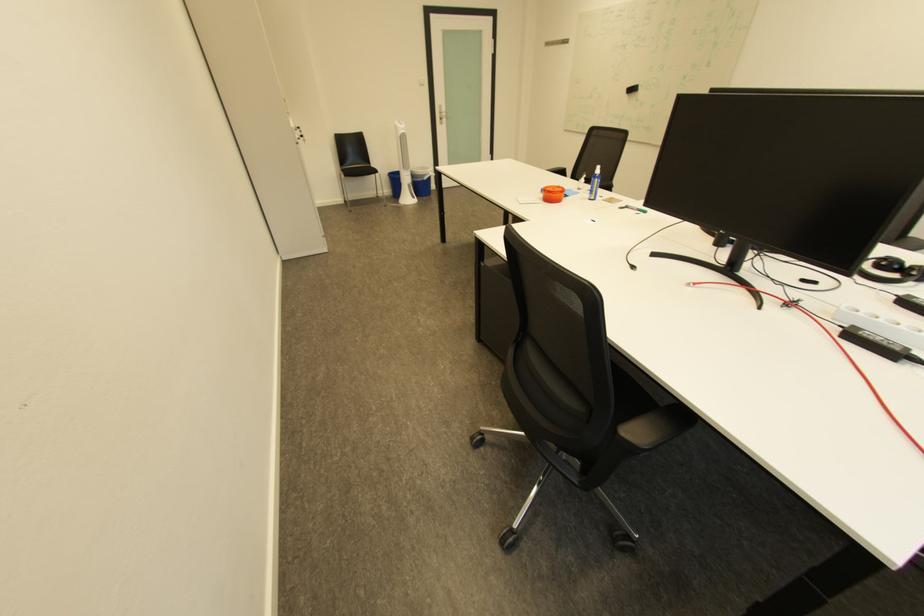
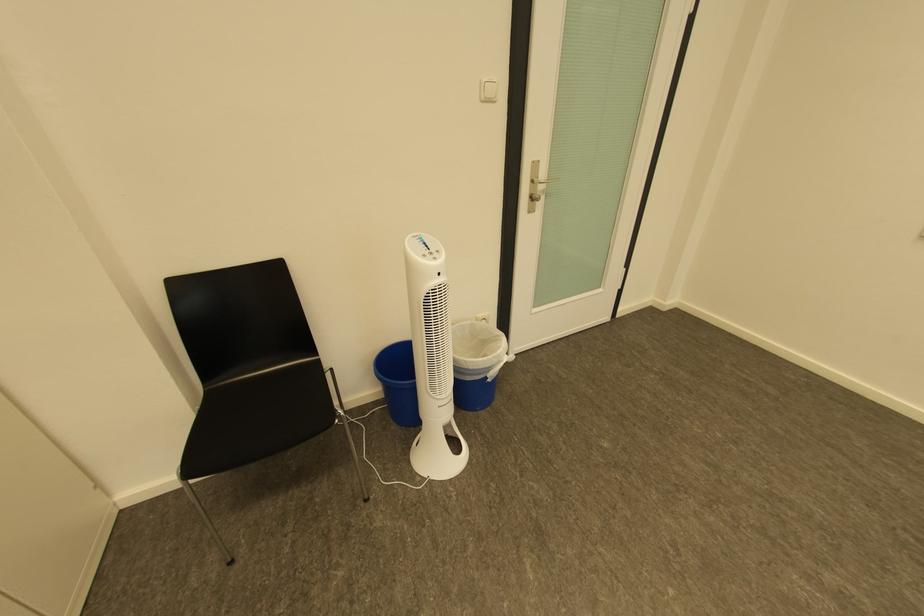
Find the pixel in the second image that matches pixel 450 114 in the first image.

(541, 182)